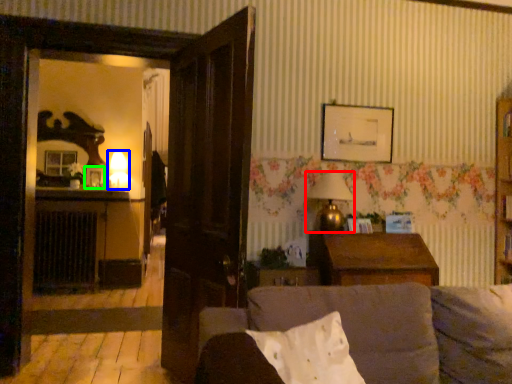
Question: Estimate the real-world distances between objects in this image. Which object is farther from lamp (highlighted by a red box), lamp (highlighted by a blue box) or picture frame (highlighted by a green box)?

Choices:
 (A) lamp
 (B) picture frame

Answer: (A)